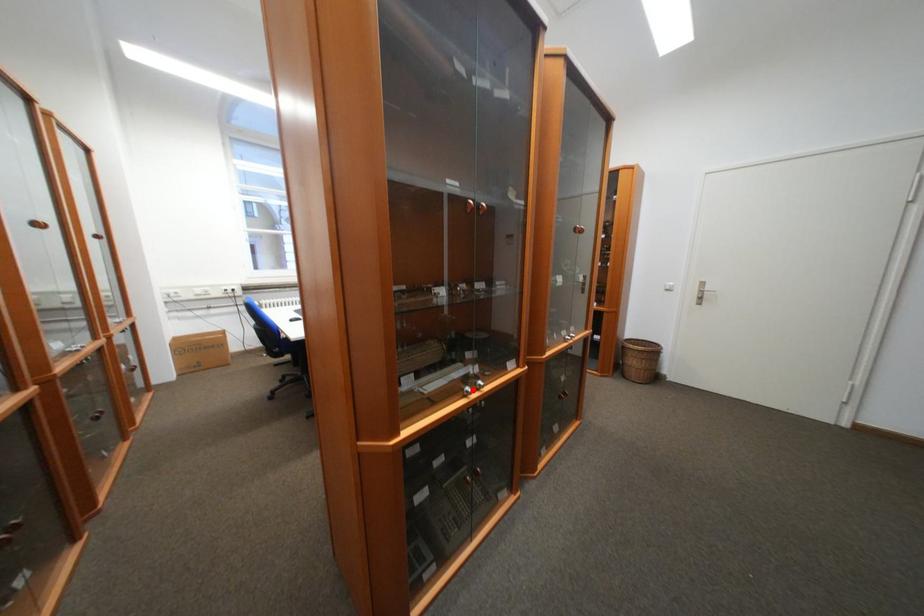
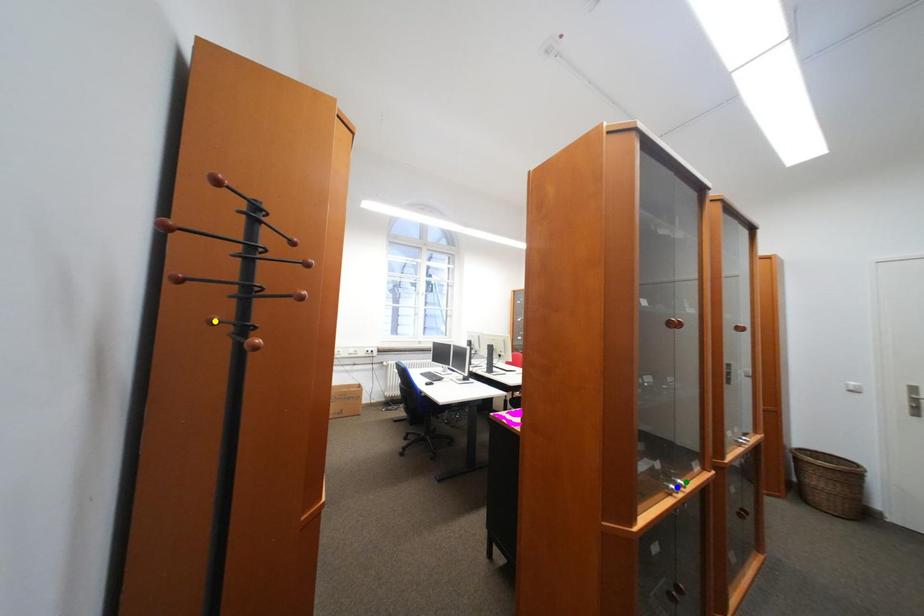
Question: I am providing you with two images of the same scene from different viewpoints. A red point is marked on the first image. You are given multiple points on the second image. Can you choose the point in image 2 that corresponds to the point in image 1?

Choices:
 (A) green point
 (B) blue point
 (C) yellow point

Answer: (B)